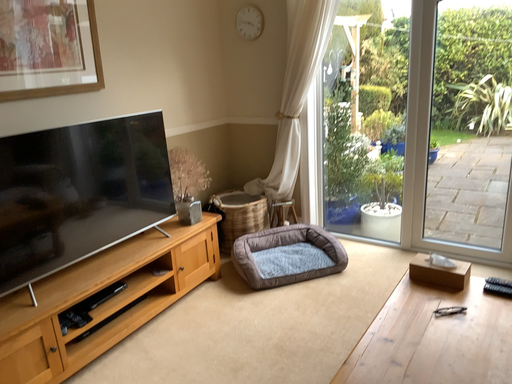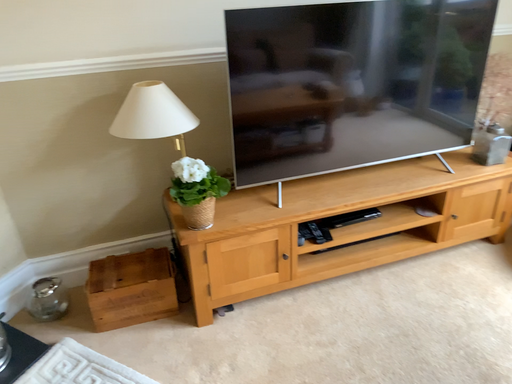
Question: Which way did the camera rotate in the video?

Choices:
 (A) rotated right
 (B) rotated left

Answer: (B)